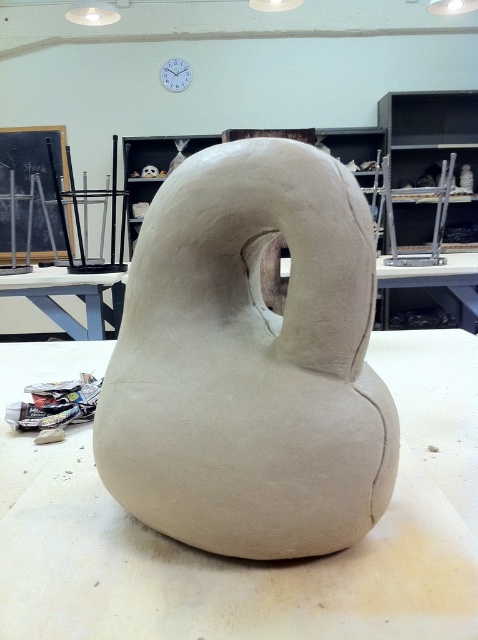
You are standing in the studio and want to touch the sculpture. Can you reach the point at coordinates (249, 362) on the clay sculpture at center?

The point at coordinates (249, 362) is on the clay sculpture at center, so yes, you can reach it.

You are an artist who just entered the studio and wants to place your new sculpture on the white matte table at center. You notice the white plastic clock at upper center. Is the clock above or below the table?

The white plastic clock at upper center is above the white matte table at center because the table is positioned under the clock.

You are an artist standing at the entrance of the studio. You want to place a new sculpture exactly at the center of the workbench. The workbench is a rectangle with its bottom edge at y coordinate 0.4 and top edge at y coordinate 0.6. The left edge is at x coordinate 0.3 and right edge at x coordinate 0.7. The white clay sculpture at center is located at point (242, 561). Is the white clay sculpture at center currently placed at the center of the workbench?

The workbench has its center at the midpoint of its coordinates. The x midpoint is between 0.3 and 0.7, which is 0.5. The y midpoint is between 0.4 and 0.6, which is 0.5. The white clay sculpture at center is at point (242, 561). Comparing coordinates, the x coordinate 0.878 is much higher than 0.5, so the sculpture is not centered on the workbench.